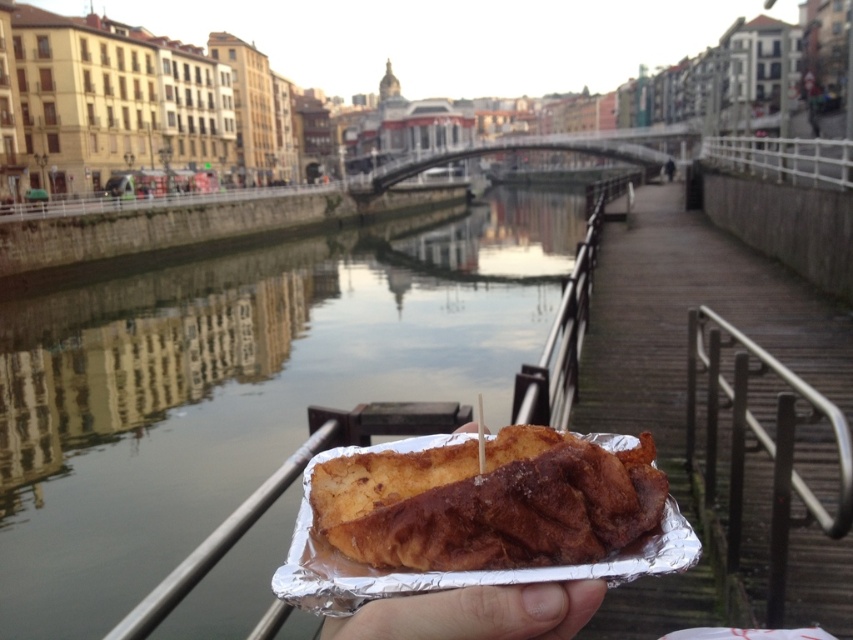
Question: Is golden-brown crispy pastry at center to the right of satin silver railing at lower right from the viewer's perspective?

Choices:
 (A) yes
 (B) no

Answer: (B)

Question: Is glossy concrete water at center to the left of frosted white hand at center from the viewer's perspective?

Choices:
 (A) no
 (B) yes

Answer: (A)

Question: Among these objects, which one is nearest to the camera?

Choices:
 (A) glossy concrete water at center
 (B) golden-brown crispy pastry at center
 (C) satin silver railing at lower right
 (D) frosted white hand at center

Answer: (D)

Question: Is satin silver railing at lower right thinner than frosted white hand at center?

Choices:
 (A) no
 (B) yes

Answer: (A)

Question: Which of the following is the farthest from the observer?

Choices:
 (A) (67, 336)
 (B) (490, 637)

Answer: (A)

Question: Which is nearer to the glossy concrete water at center?

Choices:
 (A) frosted white hand at center
 (B) golden-brown crispy pastry at center
 (C) satin silver railing at lower right

Answer: (B)